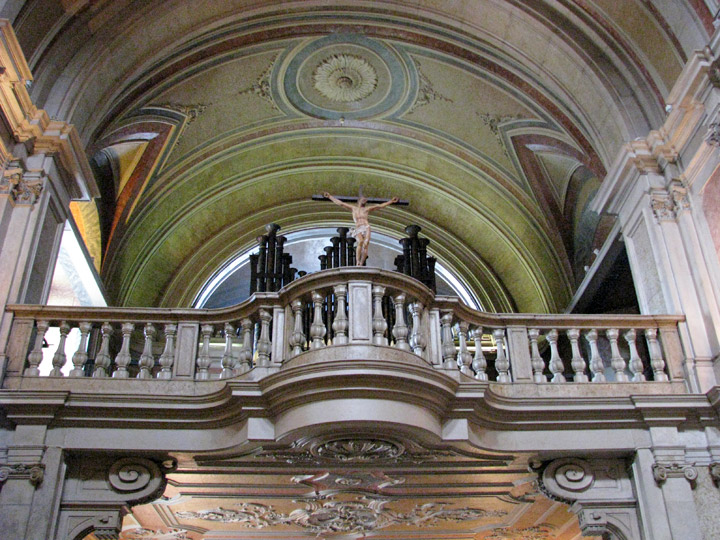
Where is `support beams`? support beams is located at coordinates (664, 256), (45, 239).